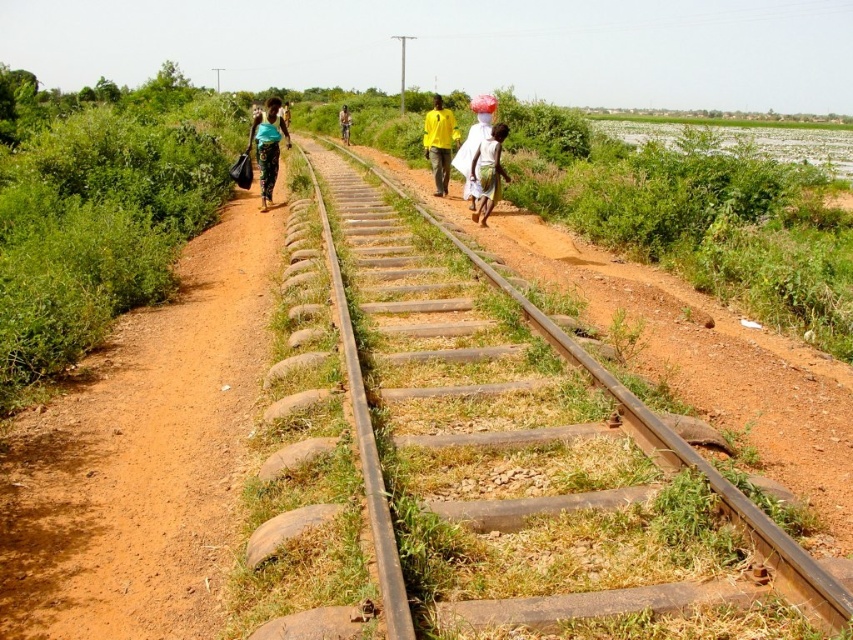
You are standing at the starting point of the railway track and see the brown dirt path at center and the matte green shirt at center. Which object is closer to you?

The brown dirt path at center is closer to you because it is in front of the matte green shirt at center.

You are standing at the point closer to the camera between the two points, point (61, 467) and point (746, 508). If you want to walk towards the other point, which direction should you move?

You should move away from the camera because point (61, 467) is closer to the viewer than point (746, 508), so moving away from the camera will take you toward the farther point.

You are a hiker who wants to walk along the brown dirt path at center and the smooth metal track at center. Which one is located to the left of the other?

The brown dirt path at center is positioned on the left side of smooth metal track at center.